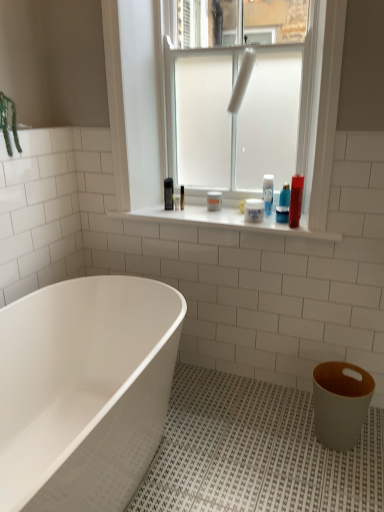
Question: Is white frosted glass at center bigger or smaller than clear glass window screen at upper center?

Choices:
 (A) small
 (B) big

Answer: (B)

Question: Is white frosted glass at center wider or thinner than clear glass window screen at upper center?

Choices:
 (A) wide
 (B) thin

Answer: (B)

Question: Estimate the real-world distances between objects in this image. Which object is farther from the shiny plastic tube at upper right, the first toiletry in the right-to-left sequence?

Choices:
 (A) white glossy bathtub at lower left
 (B) white matte jar at center, the 2th toiletry when ordered from right to left
 (C) white glossy window sill at center
 (D) white matte toilet bowl at lower right
 (E) clear glass window screen at upper center

Answer: (A)

Question: Which object is positioned closest to the white matte toilet bowl at lower right?

Choices:
 (A) clear glass window screen at upper center
 (B) white matte jar at center, the first toiletry from the left
 (C) white glossy bathtub at lower left
 (D) white glossy window sill at center
 (E) shiny plastic tube at upper right, the first toiletry in the right-to-left sequence

Answer: (D)